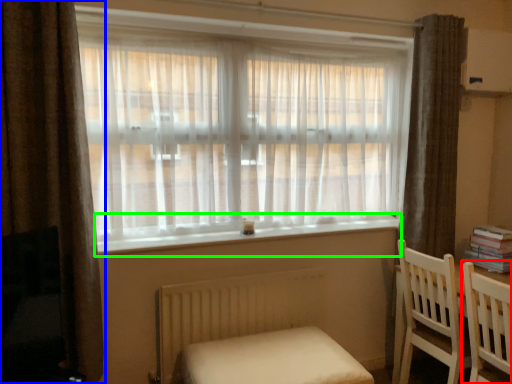
Question: Which object is positioned farthest from chair (highlighted by a red box)? Select from curtain (highlighted by a blue box) and window sill (highlighted by a green box).

Choices:
 (A) curtain
 (B) window sill

Answer: (A)